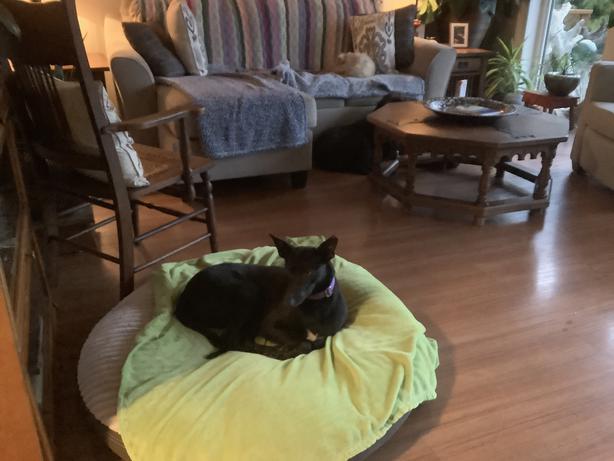
Find the location of a particular element. The width and height of the screenshot is (614, 461). dog bed is located at coordinates (107, 337).